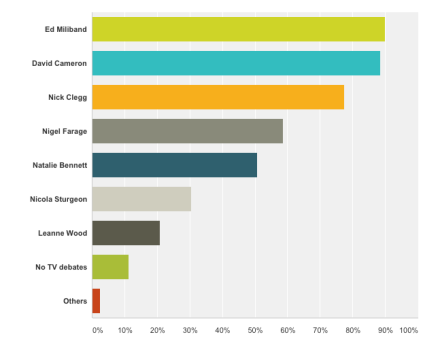
At what (x,y) coordinates should I click in order to perform the action: click on teal bar. Please return your answer as a coordinate pair (x, y). This screenshot has width=440, height=358. Looking at the image, I should click on (254, 63).